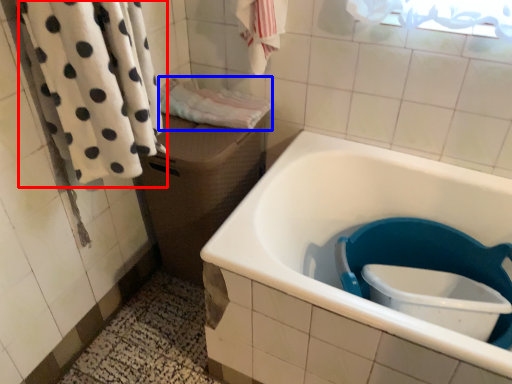
Question: Which of the following is the farthest to the observer, bath towel (highlighted by a red box) or bath towel (highlighted by a blue box)?

Choices:
 (A) bath towel
 (B) bath towel

Answer: (B)